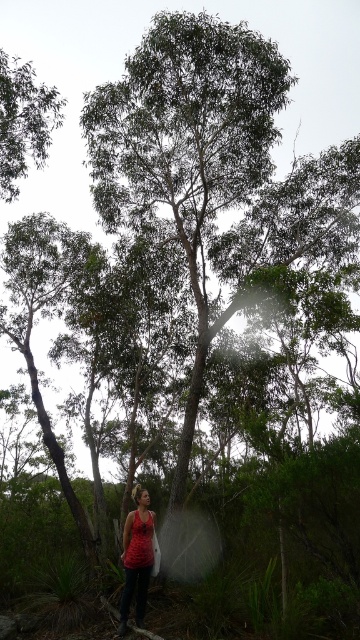
Question: Where is green leafy tree at upper left located in relation to red fabric tank top at lower center in the image?

Choices:
 (A) right
 (B) left

Answer: (B)

Question: Is green leafy tree at upper left to the right of red fabric tank top at lower center from the viewer's perspective?

Choices:
 (A) yes
 (B) no

Answer: (B)

Question: Is green leafy tree at upper left to the right of red fabric tank top at lower center from the viewer's perspective?

Choices:
 (A) no
 (B) yes

Answer: (A)

Question: Which of the following is the farthest from the observer?

Choices:
 (A) (48, 93)
 (B) (146, 500)

Answer: (A)

Question: Which point is farther to the camera?

Choices:
 (A) red fabric tank top at lower center
 (B) green leafy tree at upper left

Answer: (B)